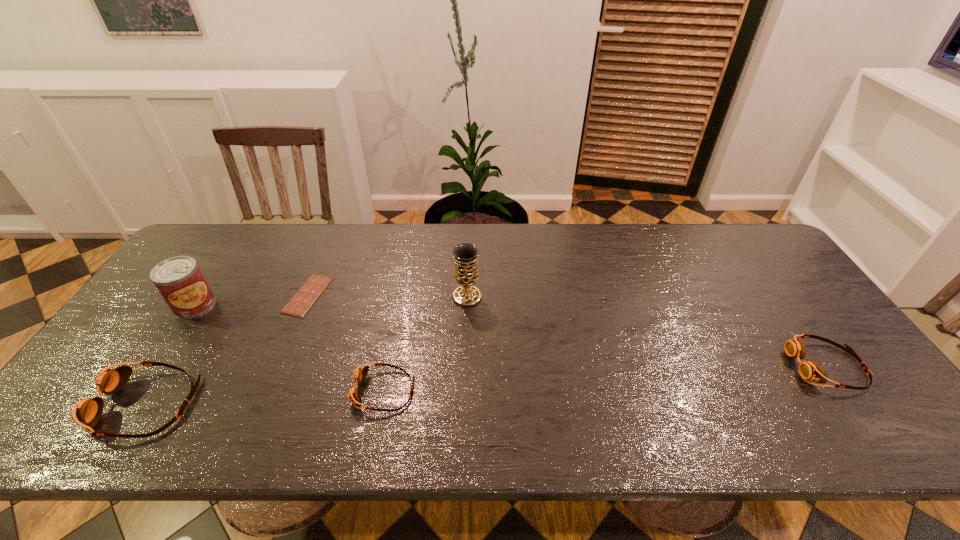
The height and width of the screenshot is (540, 960). In order to click on vacant space that is in between the can and the tallest object in this screenshot , I will do `click(330, 300)`.

You are a GUI agent. You are given a task and a screenshot of the screen. Output one action in this format:
    pyautogui.click(x=<x>, y=<y>)
    Task: Click on the free space between the can and the fifth object from left to right
    The width and height of the screenshot is (960, 540).
    Given the screenshot: What is the action you would take?
    pyautogui.click(x=330, y=300)

Locate an element on the screen. empty location between the second shortest goggles and the shortest object is located at coordinates (567, 331).

Identify the location of blank region between the chalice and the leftmost goggles. (306, 350).

Where is `vacant area that lies between the second tallest object and the shortest goggles`? vacant area that lies between the second tallest object and the shortest goggles is located at coordinates (289, 348).

Find the location of a particular element. empty location between the leftmost goggles and the second tallest goggles is located at coordinates (486, 385).

Where is `empty space between the second object from right to left and the rightmost object`? This screenshot has width=960, height=540. empty space between the second object from right to left and the rightmost object is located at coordinates (647, 332).

You are a GUI agent. You are given a task and a screenshot of the screen. Output one action in this format:
    pyautogui.click(x=<x>, y=<y>)
    Task: Click on the vacant space that is in between the third shortest object and the chalice
    
    Given the screenshot: What is the action you would take?
    pyautogui.click(x=647, y=332)

I want to click on unoccupied position between the rightmost goggles and the third tallest object, so click(486, 385).

Image resolution: width=960 pixels, height=540 pixels. In order to click on vacant area that lies between the shortest goggles and the leftmost goggles in this screenshot , I will do `click(265, 397)`.